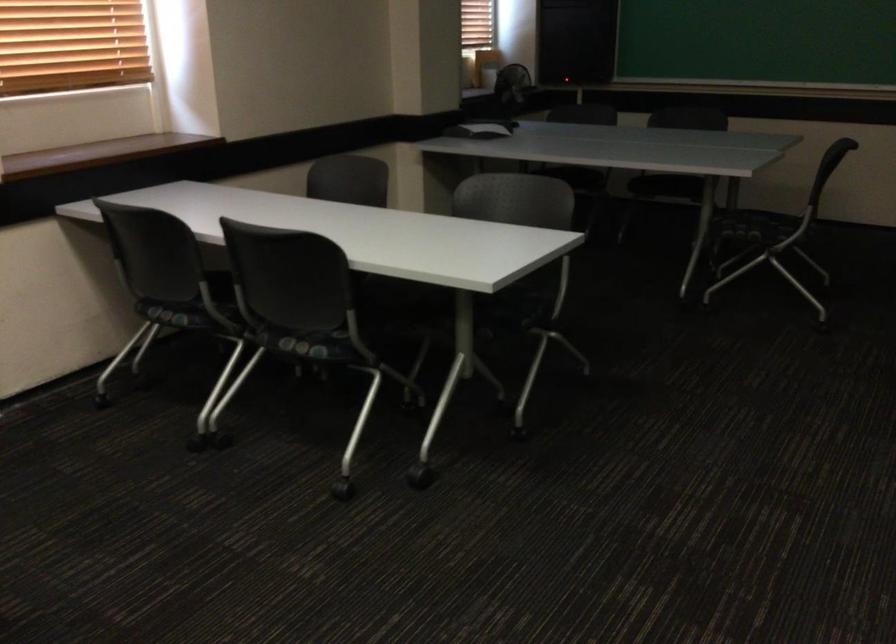
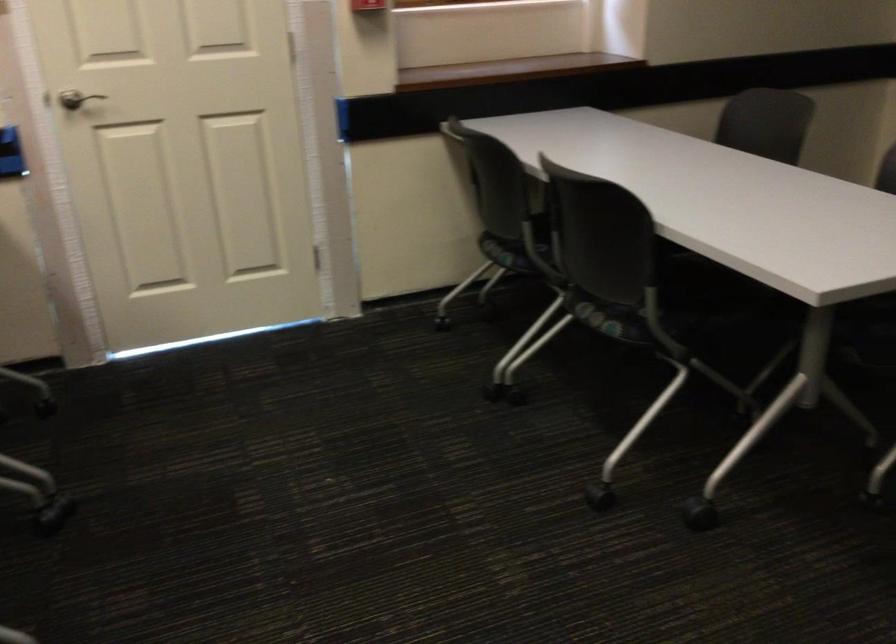
Question: How did the camera likely rotate?

Choices:
 (A) Left
 (B) Right
 (C) Up
 (D) Down

Answer: (A)